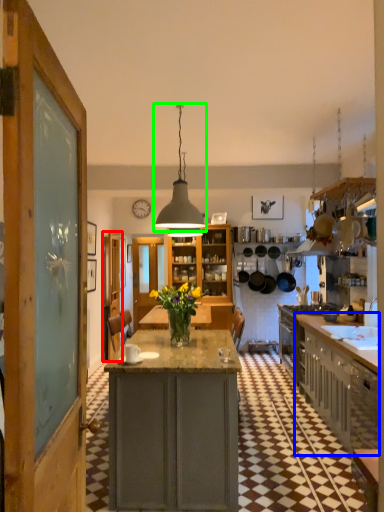
Question: Based on their relative distances, which object is nearer to door (highlighted by a red box)? Choose from cabinetry (highlighted by a blue box) and light fixture (highlighted by a green box).

Choices:
 (A) cabinetry
 (B) light fixture

Answer: (B)